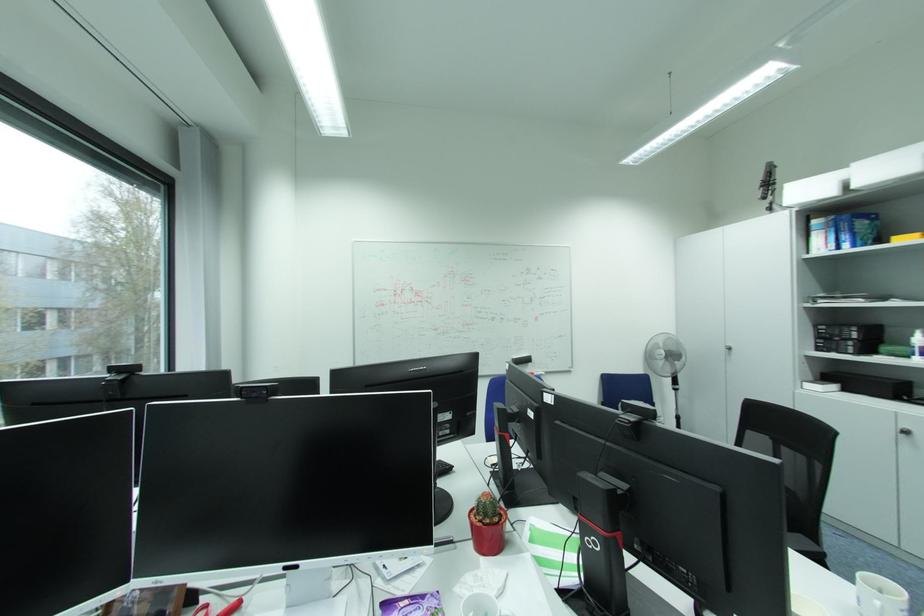
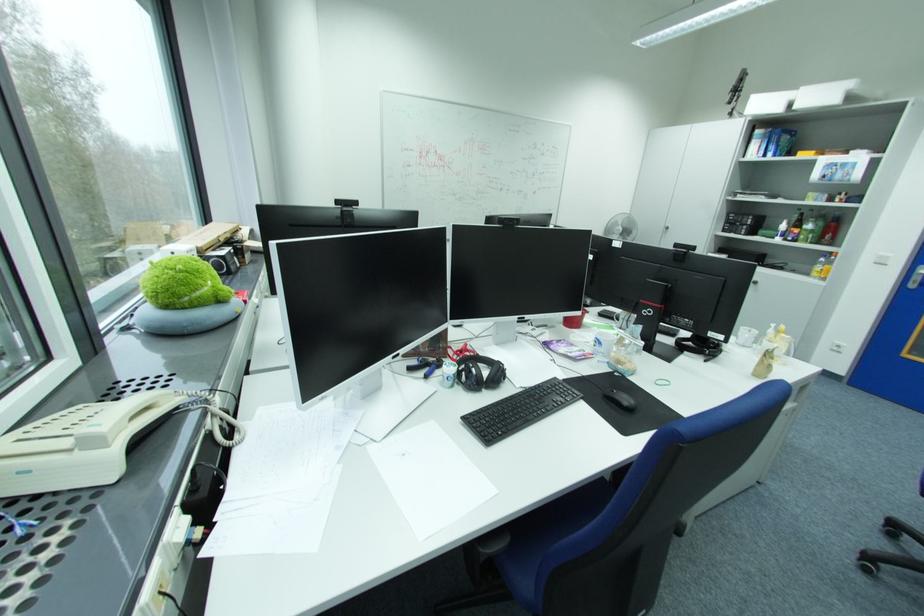
What movement of the cameraman would produce the second image?

The movement direction of the cameraman is left, backward.